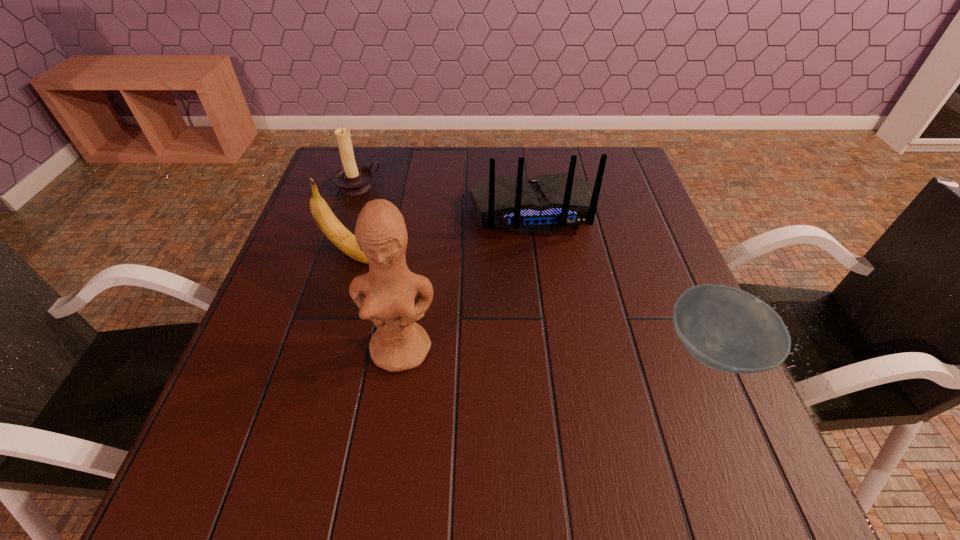
Find the location of a particular element. This screenshot has height=540, width=960. the tallest object is located at coordinates (385, 295).

I want to click on the shortest object, so click(725, 328).

Locate an element on the screen. bowl is located at coordinates (725, 328).

Find the location of a particular element. banana is located at coordinates (335, 231).

Locate an element on the screen. Image resolution: width=960 pixels, height=540 pixels. candle holder is located at coordinates (352, 179).

Identify the location of router. (548, 203).

Locate an element on the screen. Image resolution: width=960 pixels, height=540 pixels. free spot located on the front-facing side of the figurine is located at coordinates (395, 400).

Where is `free space located 0.080m on the front of the bowl`? free space located 0.080m on the front of the bowl is located at coordinates (752, 438).

The image size is (960, 540). Identify the location of free space located at the start of the peel on the banana. (487, 325).

This screenshot has height=540, width=960. Find the location of `free space located 0.070m at the start of the peel on the banana`. free space located 0.070m at the start of the peel on the banana is located at coordinates (399, 276).